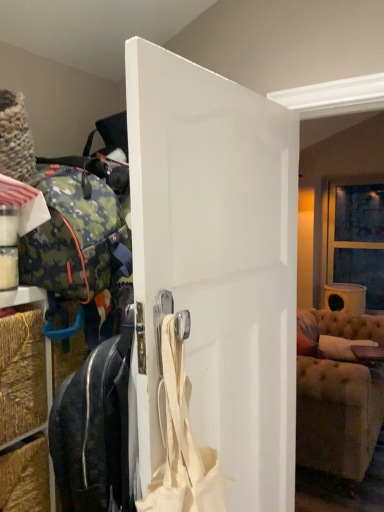
Question: From the image's perspective, relative to black leather suitcase at center, which appears as the 2th luggage and bags when viewed from the top, is tufted fabric couch at right above or below?

Choices:
 (A) above
 (B) below

Answer: (B)

Question: Visually, is tufted fabric couch at right positioned to the left or to the right of black leather suitcase at center, placed as the 1th luggage and bags when sorted from bottom to top?

Choices:
 (A) right
 (B) left

Answer: (A)

Question: Estimate the real-world distances between objects in this image. Which object is closer to the camo fabric backpack at left, which is counted as the 1th luggage and bags, starting from the top?

Choices:
 (A) tufted fabric couch at right
 (B) white matte door at center
 (C) clear glass window at upper right
 (D) black leather suitcase at center, placed as the 1th luggage and bags when sorted from bottom to top
 (E) beige fabric shoulder bag at center

Answer: (D)

Question: Based on their relative distances, which object is farther from the beige fabric shoulder bag at center?

Choices:
 (A) black leather suitcase at center, which appears as the 2th luggage and bags when viewed from the top
 (B) camo fabric backpack at left, which is counted as the 1th luggage and bags, starting from the top
 (C) white matte door at center
 (D) tufted fabric couch at right
 (E) clear glass window at upper right

Answer: (E)